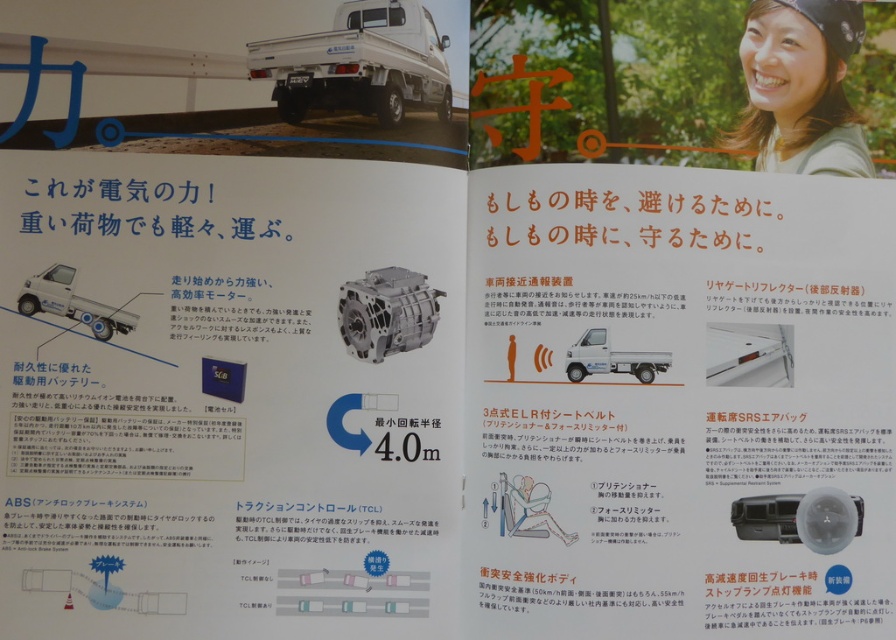
Question: Which of the following is the farthest from the observer?

Choices:
 (A) tap(772, 500)
 (B) tap(765, 116)
 (C) tap(711, 384)
 (D) tap(418, 337)

Answer: (D)

Question: Where is white matte truck at left located in relation to matte black airbag at lower center in the image?

Choices:
 (A) above
 (B) below

Answer: (A)

Question: Based on their relative distances, which object is nearer to the white matte truck at left?

Choices:
 (A) matte black airbag at lower center
 (B) metallic silver motor at center
 (C) white matte truck at center

Answer: (B)

Question: Can you confirm if matte yellow shirt at upper right is wider than white matte truck at left?

Choices:
 (A) no
 (B) yes

Answer: (B)

Question: Is white plastic reflector at center right further to the viewer compared to white matte truck at left?

Choices:
 (A) yes
 (B) no

Answer: (A)

Question: Among these points, which one is farthest from the camera?

Choices:
 (A) (771, 534)
 (B) (569, 372)
 (C) (375, 304)

Answer: (C)